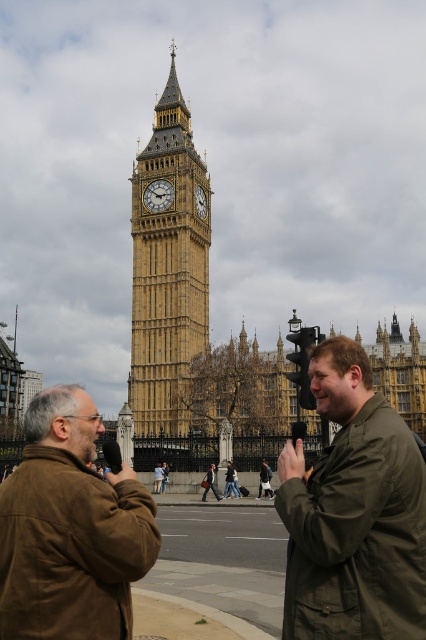
You are standing at the point marked as point (71, 529) in the image. Looking around, you see the iconic Elizabeth Tower, brown leather jacket at lower left, and green jacket at lower right. Which direction should you face to look towards the Elizabeth Tower?

The point (71, 529) is on the brown leather jacket at lower left. To look towards the Elizabeth Tower, you should face upwards since the tower is positioned above the foreground individuals in the image.